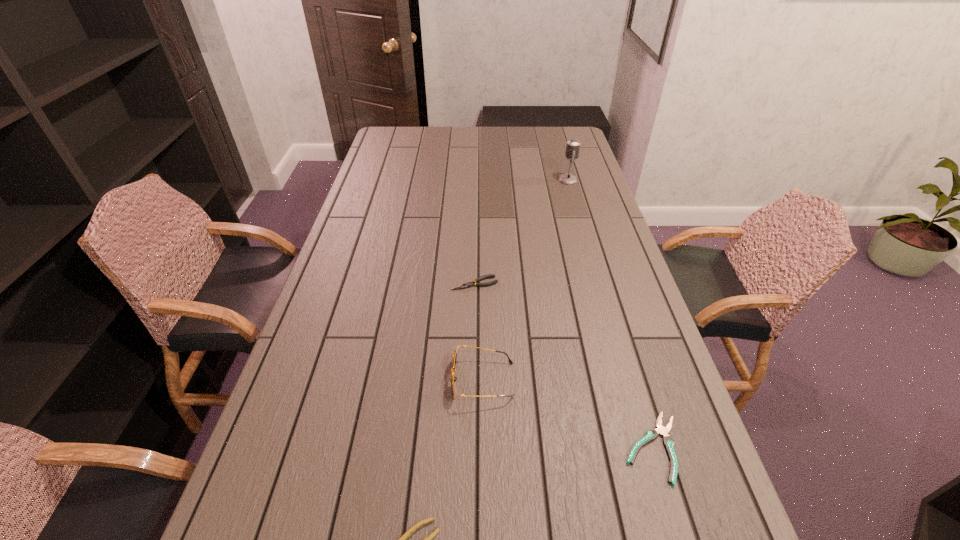
Find the location of a particular element. The width and height of the screenshot is (960, 540). free space located 0.340m on the front-facing side of the fourth shortest object is located at coordinates (309, 380).

Locate an element on the screen. Image resolution: width=960 pixels, height=540 pixels. vacant space positioned 0.250m on the front-facing side of the fourth shortest object is located at coordinates (347, 380).

Where is `vacant space located 0.080m on the front of the third tallest object`? This screenshot has height=540, width=960. vacant space located 0.080m on the front of the third tallest object is located at coordinates (474, 310).

Where is `vacant area located on the front of the fourth farthest object`? This screenshot has width=960, height=540. vacant area located on the front of the fourth farthest object is located at coordinates (678, 531).

Image resolution: width=960 pixels, height=540 pixels. I want to click on microphone present at the right edge, so click(573, 145).

The height and width of the screenshot is (540, 960). What are the coordinates of `pliers that is at the right edge` in the screenshot? It's located at (652, 434).

Find the location of a particular element. free region at the far edge is located at coordinates (506, 139).

In the image, there is a desktop. At what (x,y) coordinates should I click in order to perform the action: click on vacant space at the left edge. Please return your answer as a coordinate pair (x, y). Image resolution: width=960 pixels, height=540 pixels. Looking at the image, I should click on (252, 483).

Locate an element on the screen. The image size is (960, 540). free region at the right edge of the desktop is located at coordinates (598, 237).

Locate an element on the screen. vacant area at the far left corner of the desktop is located at coordinates (397, 143).